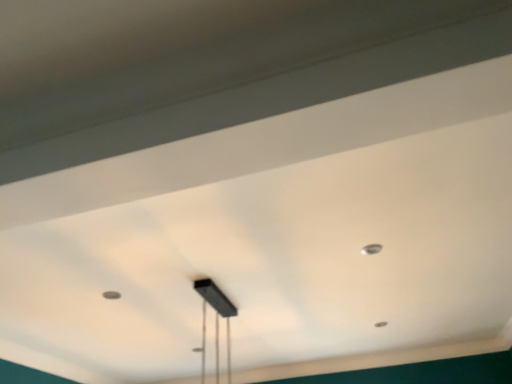
The image size is (512, 384). What do you see at coordinates (371, 249) in the screenshot?
I see `metallic silver dot at upper right` at bounding box center [371, 249].

Find the location of a particular element. Image resolution: width=512 pixels, height=384 pixels. metallic silver dot at upper right is located at coordinates (371, 249).

This screenshot has height=384, width=512. Find the location of `black matte rectangular light fixture at center`. black matte rectangular light fixture at center is located at coordinates (216, 321).

From the picture: Measure the distance between point (x=216, y=311) and camera.

The depth of point (x=216, y=311) is 9.12 feet.

This screenshot has height=384, width=512. What do you see at coordinates (216, 321) in the screenshot? I see `black matte rectangular light fixture at center` at bounding box center [216, 321].

Find the location of a particular element. The height and width of the screenshot is (384, 512). metallic silver dot at upper right is located at coordinates (371, 249).

Is black matte rectangular light fixture at center to the right of metallic silver dot at upper right from the viewer's perspective?

Incorrect, black matte rectangular light fixture at center is not on the right side of metallic silver dot at upper right.

Which object is more forward, black matte rectangular light fixture at center or metallic silver dot at upper right?

black matte rectangular light fixture at center.

Considering the positions of point (227, 357) and point (365, 254), is point (227, 357) closer or farther from the camera than point (365, 254)?

Point (227, 357) is farther from the camera than point (365, 254).

From the image's perspective, does black matte rectangular light fixture at center appear lower than metallic silver dot at upper right?

Yes, from the image's perspective, black matte rectangular light fixture at center is below metallic silver dot at upper right.

From a real-world perspective, is black matte rectangular light fixture at center located higher than metallic silver dot at upper right?

No.

Is black matte rectangular light fixture at center wider or thinner than metallic silver dot at upper right?

Considering their sizes, black matte rectangular light fixture at center looks broader than metallic silver dot at upper right.

Which of these two, black matte rectangular light fixture at center or metallic silver dot at upper right, stands taller?

black matte rectangular light fixture at center.

Considering the sizes of objects black matte rectangular light fixture at center and metallic silver dot at upper right in the image provided, who is smaller, black matte rectangular light fixture at center or metallic silver dot at upper right?

metallic silver dot at upper right.

Is metallic silver dot at upper right located within black matte rectangular light fixture at center?

That's incorrect, metallic silver dot at upper right is not inside black matte rectangular light fixture at center.

Is there a large distance between black matte rectangular light fixture at center and metallic silver dot at upper right?

Yes, black matte rectangular light fixture at center and metallic silver dot at upper right are quite far apart.

Does black matte rectangular light fixture at center turn towards metallic silver dot at upper right?

Yes, black matte rectangular light fixture at center is facing metallic silver dot at upper right.

Where is `lamp in front of the metallic silver dot at upper right`? lamp in front of the metallic silver dot at upper right is located at coordinates (216, 321).

Is metallic silver dot at upper right at the left side of black matte rectangular light fixture at center?

No, metallic silver dot at upper right is not to the left of black matte rectangular light fixture at center.

Does metallic silver dot at upper right lie in front of black matte rectangular light fixture at center?

No.

Considering the positions of points (373, 253) and (218, 311), is point (373, 253) closer to camera compared to point (218, 311)?

Yes, point (373, 253) is closer to viewer.

From the image's perspective, would you say metallic silver dot at upper right is shown under black matte rectangular light fixture at center?

No, from the image's perspective, metallic silver dot at upper right is not below black matte rectangular light fixture at center.

From a real-world perspective, is metallic silver dot at upper right on black matte rectangular light fixture at center?

Yes, from a real-world perspective, metallic silver dot at upper right is over black matte rectangular light fixture at center

Considering the sizes of objects metallic silver dot at upper right and black matte rectangular light fixture at center in the image provided, who is thinner, metallic silver dot at upper right or black matte rectangular light fixture at center?

metallic silver dot at upper right.

Can you confirm if metallic silver dot at upper right is taller than black matte rectangular light fixture at center?

No, metallic silver dot at upper right is not taller than black matte rectangular light fixture at center.

Who is bigger, metallic silver dot at upper right or black matte rectangular light fixture at center?

With larger size is black matte rectangular light fixture at center.

Is metallic silver dot at upper right positioned beyond the bounds of black matte rectangular light fixture at center?

Yes, metallic silver dot at upper right is outside of black matte rectangular light fixture at center.

Would you consider metallic silver dot at upper right to be distant from black matte rectangular light fixture at center?

Yes.

Is black matte rectangular light fixture at center at the back of metallic silver dot at upper right?

No, black matte rectangular light fixture at center is not at the back of metallic silver dot at upper right.

The width and height of the screenshot is (512, 384). Find the location of `dot to the right of black matte rectangular light fixture at center`. dot to the right of black matte rectangular light fixture at center is located at coordinates (371, 249).

Where is `dot that is above the black matte rectangular light fixture at center (from the image's perspective)`? dot that is above the black matte rectangular light fixture at center (from the image's perspective) is located at coordinates tap(371, 249).

This screenshot has width=512, height=384. In order to click on dot above the black matte rectangular light fixture at center (from a real-world perspective) in this screenshot , I will do pyautogui.click(x=371, y=249).